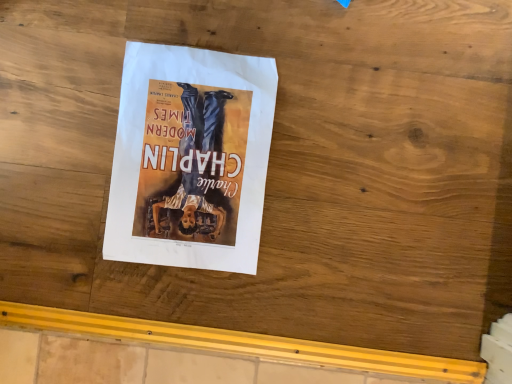
This screenshot has height=384, width=512. Identify the location of matte paper poster at center. (190, 158).

What do you see at coordinates (190, 158) in the screenshot?
I see `matte paper poster at center` at bounding box center [190, 158].

This screenshot has width=512, height=384. I want to click on matte paper poster at center, so click(x=190, y=158).